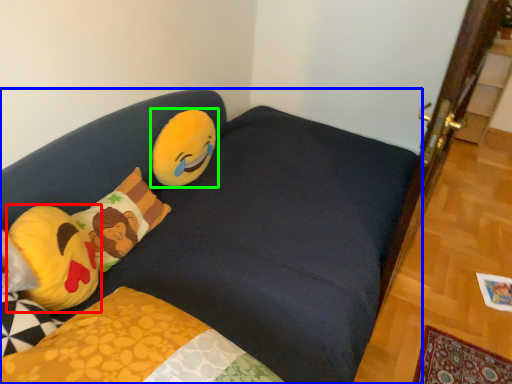
Question: Which object is positioned farthest from pillow (highlighted by a red box)? Select from studio couch (highlighted by a blue box) and toy (highlighted by a green box).

Choices:
 (A) studio couch
 (B) toy

Answer: (B)